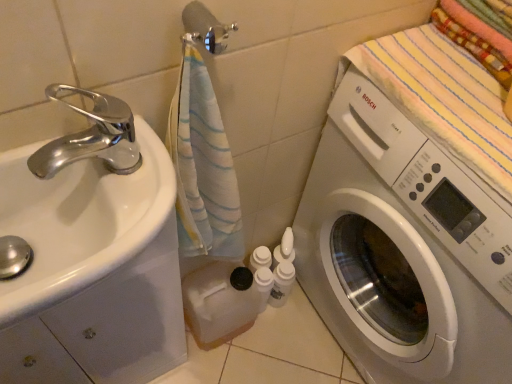
Locate an element on the screen. striped cotton beach towel at upper right is located at coordinates (442, 96).

This screenshot has width=512, height=384. I want to click on white glossy sink at left, so click(x=82, y=202).

What is the approximate width of silver metallic towel bar at upper center?

It is 2.83 inches.

The width and height of the screenshot is (512, 384). Identify the location of striped cotton beach towel at upper right. (442, 96).

Between silver metallic towel bar at upper center and white glossy sink at left, which one has more height?

Standing taller between the two is white glossy sink at left.

Is point (213, 29) positioned after point (19, 217)?

No, it is in front of (19, 217).

Is white glossy sink at left located within silver metallic towel bar at upper center?

No, white glossy sink at left is not inside silver metallic towel bar at upper center.

Which object is positioned more to the right, silver metallic towel bar at upper center or white glossy sink at left?

Positioned to the right is silver metallic towel bar at upper center.

From a real-world perspective, which is physically above, striped cotton beach towel at upper right or silver metallic towel bar at upper center?

In real-world perspective, silver metallic towel bar at upper center is above.

The height and width of the screenshot is (384, 512). In order to click on beach towel that appears below the silver metallic towel bar at upper center (from a real-world perspective) in this screenshot , I will do tap(442, 96).

Would you consider striped cotton beach towel at upper right to be distant from silver metallic towel bar at upper center?

striped cotton beach towel at upper right is near silver metallic towel bar at upper center, not far away.

From the picture: Can you confirm if silver metallic towel bar at upper center is bigger than white glossy washing machine at right?

Incorrect, silver metallic towel bar at upper center is not larger than white glossy washing machine at right.

Is silver metallic towel bar at upper center shorter than white glossy washing machine at right?

Correct, silver metallic towel bar at upper center is not as tall as white glossy washing machine at right.

How many degrees apart are the facing directions of silver metallic towel bar at upper center and white glossy washing machine at right?

silver metallic towel bar at upper center and white glossy washing machine at right are facing 88.1 degrees away from each other.

Is the position of silver metallic towel bar at upper center more distant than that of white glossy washing machine at right?

Yes, silver metallic towel bar at upper center is further from the viewer.

Can you confirm if striped cotton beach towel at upper right is positioned to the right of white glossy sink at left?

Yes, striped cotton beach towel at upper right is to the right of white glossy sink at left.

The width and height of the screenshot is (512, 384). In the image, there is a striped cotton beach towel at upper right. Identify the location of sink below it (from the image's perspective). pos(82,202).

How many degrees apart are the facing directions of striped cotton beach towel at upper right and white glossy sink at left?

The angle between the facing direction of striped cotton beach towel at upper right and the facing direction of white glossy sink at left is 90.5 degrees.

Could you tell me if striped cotton beach towel at upper right is turned towards white glossy sink at left?

Yes, striped cotton beach towel at upper right is aimed at white glossy sink at left.

Is striped cotton beach towel at upper right at the left side of white glossy washing machine at right?

Indeed, striped cotton beach towel at upper right is positioned on the left side of white glossy washing machine at right.

Considering the points (510, 182) and (371, 281), which point is behind, point (510, 182) or point (371, 281)?

The point (371, 281) is farther from the camera.

Consider the image. In terms of width, does striped cotton beach towel at upper right look wider or thinner when compared to white glossy washing machine at right?

Considering their sizes, striped cotton beach towel at upper right looks slimmer than white glossy washing machine at right.

Is striped cotton beach towel at upper right situated inside white glossy washing machine at right or outside?

striped cotton beach towel at upper right is enclosed within white glossy washing machine at right.

From the image's perspective, is white glossy washing machine at right located beneath striped cotton beach towel at upper right?

Yes, from the image's perspective, white glossy washing machine at right is below striped cotton beach towel at upper right.

Based on the photo, does white glossy washing machine at right have a greater width compared to striped cotton beach towel at upper right?

Correct, the width of white glossy washing machine at right exceeds that of striped cotton beach towel at upper right.

Is white glossy washing machine at right positioned with its back to striped cotton beach towel at upper right?

A: No.

Does white glossy sink at left have a smaller size compared to striped cotton beach towel at upper right?

Indeed, white glossy sink at left has a smaller size compared to striped cotton beach towel at upper right.

Which is in front, point (103, 266) or point (460, 142)?

The point (103, 266) is more forward.

From a real-world perspective, is white glossy sink at left physically below striped cotton beach towel at upper right?

Yes, from a real-world perspective, white glossy sink at left is under striped cotton beach towel at upper right.

Identify the location of beach towel positioned vertically above the white glossy sink at left (from a real-world perspective). This screenshot has width=512, height=384. point(442,96).

In the image, there is a silver metallic towel bar at upper center. Where is `sink below it (from the image's perspective)`? This screenshot has width=512, height=384. sink below it (from the image's perspective) is located at coordinates (82, 202).

Identify the location of beach towel below the silver metallic towel bar at upper center (from a real-world perspective). This screenshot has width=512, height=384. (442, 96).

Which object lies further to the anchor point silver metallic towel bar at upper center, striped cotton beach towel at upper right or white glossy washing machine at right?

Based on the image, white glossy washing machine at right appears to be further to silver metallic towel bar at upper center.

From the image, which object appears to be nearer to white glossy washing machine at right, white glossy sink at left or silver metallic towel bar at upper center?

The object closer to white glossy washing machine at right is white glossy sink at left.

When comparing their distances from striped cotton beach towel at upper right, does white glossy washing machine at right or white glossy sink at left seem closer?

white glossy washing machine at right lies closer to striped cotton beach towel at upper right than the other object.

From the image, which object appears to be farther from silver metallic towel bar at upper center, striped cotton beach towel at upper right or white glossy sink at left?

striped cotton beach towel at upper right.

When comparing their distances from white glossy washing machine at right, does striped cotton beach towel at upper right or silver metallic towel bar at upper center seem closer?

striped cotton beach towel at upper right is positioned closer to the anchor white glossy washing machine at right.

Considering their positions, is white glossy sink at left positioned closer to striped cotton beach towel at upper right than silver metallic towel bar at upper center?

silver metallic towel bar at upper center.

Considering their positions, is striped cotton beach towel at upper right positioned closer to white glossy sink at left than silver metallic towel bar at upper center?

silver metallic towel bar at upper center lies closer to white glossy sink at left than the other object.

Estimate the real-world distances between objects in this image. Which object is further from silver metallic towel bar at upper center, white glossy sink at left or striped cotton beach towel at upper right?

The object further to silver metallic towel bar at upper center is striped cotton beach towel at upper right.

Find the location of a particular element. beach towel between silver metallic towel bar at upper center and white glossy washing machine at right is located at coordinates (442, 96).

Locate an element on the screen. towel bar between white glossy sink at left and striped cotton beach towel at upper right from left to right is located at coordinates (205, 27).

Find the location of a particular element. beach towel between white glossy sink at left and white glossy washing machine at right in the horizontal direction is located at coordinates (442, 96).

This screenshot has height=384, width=512. I want to click on towel bar between white glossy sink at left and white glossy washing machine at right, so click(205, 27).